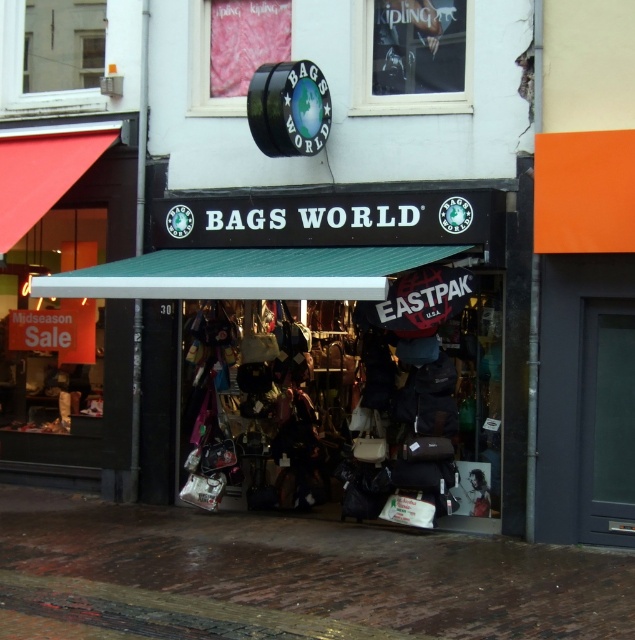
In the scene shown: Is matte black awning at center thinner than brown brick pavement at lower center?

No.

Which is more to the left, matte black awning at center or brown brick pavement at lower center?

brown brick pavement at lower center

Between point (335, 196) and point (62, 564), which one is positioned behind?

The point (335, 196) is more distant.

Find the location of a particular element. The image size is (635, 640). matte black awning at center is located at coordinates (318, 337).